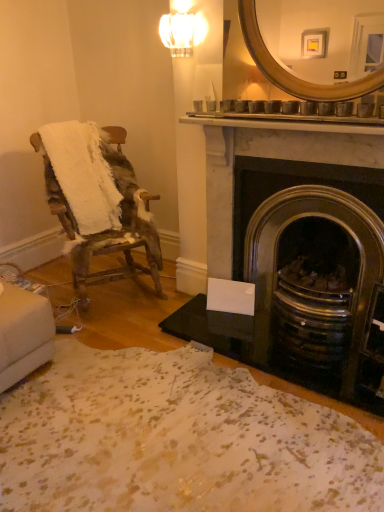
What is the approximate width of gold metallic mirror at upper center?

The width of gold metallic mirror at upper center is 5.59 inches.

Locate an element on the screen. clear glass sconce at upper center is located at coordinates (182, 28).

Is point (211, 230) closer or farther from the camera than point (40, 146)?

Point (211, 230) is positioned closer to the camera compared to point (40, 146).

Is dark gray stone fireplace at center right bigger or smaller than worn wood chair at left?

In the image, dark gray stone fireplace at center right appears to be smaller than worn wood chair at left.

Is dark gray stone fireplace at center right positioned far away from worn wood chair at left?

No, dark gray stone fireplace at center right is in close proximity to worn wood chair at left.

Is worn wood chair at left thinner than clear glass sconce at upper center?

No.

From the image's perspective, is worn wood chair at left below clear glass sconce at upper center?

Yes.

In terms of height, does worn wood chair at left look taller or shorter compared to clear glass sconce at upper center?

Considering their sizes, worn wood chair at left has more height than clear glass sconce at upper center.

Is clear glass sconce at upper center a part of worn wood chair at left?

No, worn wood chair at left does not contain clear glass sconce at upper center.

Is worn wood chair at left a part of gold metallic mirror at upper center?

Actually, worn wood chair at left is outside gold metallic mirror at upper center.

At what (x,y) coordinates should I click in order to perform the action: click on mirror that is above the worn wood chair at left (from a real-world perspective). Please return your answer as a coordinate pair (x, y). The height and width of the screenshot is (512, 384). Looking at the image, I should click on (314, 32).

Considering the positions of objects gold metallic mirror at upper center and worn wood chair at left in the image provided, who is in front, gold metallic mirror at upper center or worn wood chair at left?

gold metallic mirror at upper center.

Based on the photo, considering the relative sizes of clear glass sconce at upper center and gold metallic mirror at upper center in the image provided, is clear glass sconce at upper center thinner than gold metallic mirror at upper center?

Indeed, clear glass sconce at upper center has a lesser width compared to gold metallic mirror at upper center.

How many degrees apart are the facing directions of clear glass sconce at upper center and gold metallic mirror at upper center?

0.0035 degrees.

Does clear glass sconce at upper center have a smaller size compared to gold metallic mirror at upper center?

Indeed, clear glass sconce at upper center has a smaller size compared to gold metallic mirror at upper center.

You are a GUI agent. You are given a task and a screenshot of the screen. Output one action in this format:
    pyautogui.click(x=<x>, y=<y>)
    Task: Click on the light fixture above the gold metallic mirror at upper center (from the image's perspective)
    This screenshot has width=384, height=512.
    Given the screenshot: What is the action you would take?
    pyautogui.click(x=182, y=28)

From the image's perspective, is clear glass sconce at upper center positioned above or below worn wood chair at left?

From the image's perspective, clear glass sconce at upper center appears above worn wood chair at left.

In terms of size, does clear glass sconce at upper center appear bigger or smaller than worn wood chair at left?

In the image, clear glass sconce at upper center appears to be smaller than worn wood chair at left.

Measure the distance between clear glass sconce at upper center and worn wood chair at left.

clear glass sconce at upper center is 1.06 meters from worn wood chair at left.

Is point (185, 38) positioned in front of point (119, 243)?

Yes, point (185, 38) is in front of point (119, 243).

Between clear glass sconce at upper center and dark gray stone fireplace at center right, which one has larger size?

dark gray stone fireplace at center right is bigger.

Is clear glass sconce at upper center turned away from dark gray stone fireplace at center right?

clear glass sconce at upper center does not have its back to dark gray stone fireplace at center right.

Is clear glass sconce at upper center closer to the viewer compared to dark gray stone fireplace at center right?

That is False.

Choose the correct answer: Is clear glass sconce at upper center inside dark gray stone fireplace at center right or outside it?

clear glass sconce at upper center lies outside dark gray stone fireplace at center right.

Is dark gray stone fireplace at center right located outside gold metallic mirror at upper center?

Yes.

From the picture: From the image's perspective, is dark gray stone fireplace at center right located above or below gold metallic mirror at upper center?

dark gray stone fireplace at center right is below gold metallic mirror at upper center.

Which object is wider, dark gray stone fireplace at center right or gold metallic mirror at upper center?

With larger width is dark gray stone fireplace at center right.

How different are the orientations of dark gray stone fireplace at center right and gold metallic mirror at upper center in degrees?

The angle between the facing direction of dark gray stone fireplace at center right and the facing direction of gold metallic mirror at upper center is 0.622 degrees.

This screenshot has height=512, width=384. I want to click on chair behind the dark gray stone fireplace at center right, so click(x=122, y=226).

Where is `chair that appears in front of the clear glass sconce at upper center`? The height and width of the screenshot is (512, 384). chair that appears in front of the clear glass sconce at upper center is located at coordinates [x=122, y=226].

Which object lies further to the anchor point worn wood chair at left, gold metallic mirror at upper center or dark gray stone fireplace at center right?

The object further to worn wood chair at left is gold metallic mirror at upper center.

Considering their positions, is worn wood chair at left positioned closer to clear glass sconce at upper center than dark gray stone fireplace at center right?

dark gray stone fireplace at center right.

Based on their spatial positions, is gold metallic mirror at upper center or clear glass sconce at upper center closer to dark gray stone fireplace at center right?

gold metallic mirror at upper center is positioned closer to the anchor dark gray stone fireplace at center right.

From the image, which object appears to be nearer to worn wood chair at left, clear glass sconce at upper center or dark gray stone fireplace at center right?

dark gray stone fireplace at center right.

Based on their spatial positions, is clear glass sconce at upper center or worn wood chair at left closer to gold metallic mirror at upper center?

clear glass sconce at upper center is positioned closer to the anchor gold metallic mirror at upper center.

Which object lies further to the anchor point dark gray stone fireplace at center right, gold metallic mirror at upper center or worn wood chair at left?

The object further to dark gray stone fireplace at center right is worn wood chair at left.

Based on their spatial positions, is dark gray stone fireplace at center right or worn wood chair at left further from clear glass sconce at upper center?

worn wood chair at left is positioned further to the anchor clear glass sconce at upper center.

Based on the photo, based on their spatial positions, is dark gray stone fireplace at center right or gold metallic mirror at upper center closer to clear glass sconce at upper center?

gold metallic mirror at upper center.

Locate an element on the screen. The height and width of the screenshot is (512, 384). mirror situated between worn wood chair at left and dark gray stone fireplace at center right from left to right is located at coordinates (314, 32).

Identify the location of mirror between clear glass sconce at upper center and dark gray stone fireplace at center right in the up-down direction. (314, 32).

Image resolution: width=384 pixels, height=512 pixels. Find the location of `light fixture between worn wood chair at left and gold metallic mirror at upper center from left to right`. light fixture between worn wood chair at left and gold metallic mirror at upper center from left to right is located at coordinates (182, 28).

At what (x,y) coordinates should I click in order to perform the action: click on light fixture between worn wood chair at left and dark gray stone fireplace at center right. Please return your answer as a coordinate pair (x, y). Image resolution: width=384 pixels, height=512 pixels. Looking at the image, I should click on 182,28.